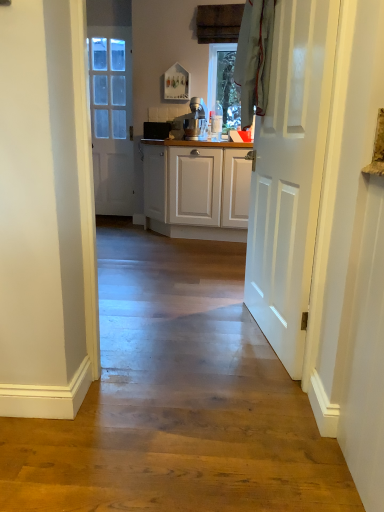
Question: In which direction should I rotate to look at satin silver mixer at center, which is the first appliance from front to back?

Choices:
 (A) right
 (B) left

Answer: (A)

Question: From the image's perspective, is white glossy door at center, the first door from the right, under satin silver mixer at center, the 2th appliance from the back?

Choices:
 (A) yes
 (B) no

Answer: (A)

Question: Can you confirm if white glossy door at center, which ranks as the 1th door in front-to-back order, is positioned to the left of satin silver mixer at center, which is the first appliance from front to back?

Choices:
 (A) yes
 (B) no

Answer: (B)

Question: From a real-world perspective, is white glossy door at center, acting as the 2th door starting from the back, physically below satin silver mixer at center, which ranks as the first appliance in right-to-left order?

Choices:
 (A) yes
 (B) no

Answer: (A)

Question: Is white glossy door at center, the first door from the right, facing away from satin silver mixer at center, which is the first appliance from front to back?

Choices:
 (A) no
 (B) yes

Answer: (A)

Question: Is white glossy door at center, which is the 2th door in left-to-right order, oriented towards satin silver mixer at center, the second appliance positioned from the left?

Choices:
 (A) no
 (B) yes

Answer: (A)

Question: Is white glossy door at center, which is the 2th door in left-to-right order, positioned behind satin silver mixer at center, which is the first appliance from front to back?

Choices:
 (A) yes
 (B) no

Answer: (B)

Question: Are white glossy door at left, the 1th door viewed from the back, and white glossy door at center, acting as the 2th door starting from the back, making contact?

Choices:
 (A) no
 (B) yes

Answer: (A)

Question: Considering the relative sizes of white glossy door at left, the 1th door viewed from the back, and white glossy door at center, which ranks as the 1th door in front-to-back order, in the image provided, is white glossy door at left, the 1th door viewed from the back, taller than white glossy door at center, which ranks as the 1th door in front-to-back order,?

Choices:
 (A) yes
 (B) no

Answer: (A)

Question: Can we say white glossy door at left, positioned as the second door in right-to-left order, lies outside white glossy door at center, which is the 2th door in left-to-right order?

Choices:
 (A) yes
 (B) no

Answer: (A)

Question: From a real-world perspective, is white glossy door at left, the second door viewed from the front, on white glossy door at center, which ranks as the 1th door in front-to-back order?

Choices:
 (A) no
 (B) yes

Answer: (B)

Question: Is white glossy door at left, the 1th door viewed from the back, wider than white glossy door at center, acting as the 2th door starting from the back?

Choices:
 (A) no
 (B) yes

Answer: (A)

Question: Is the depth of white glossy door at left, the 1th door when ordered from left to right, greater than that of white glossy door at center, acting as the 2th door starting from the back?

Choices:
 (A) no
 (B) yes

Answer: (B)

Question: Is satin silver mixer at center, the second appliance positioned from the left, in contact with white glossy door at left, the 1th door viewed from the back?

Choices:
 (A) yes
 (B) no

Answer: (B)